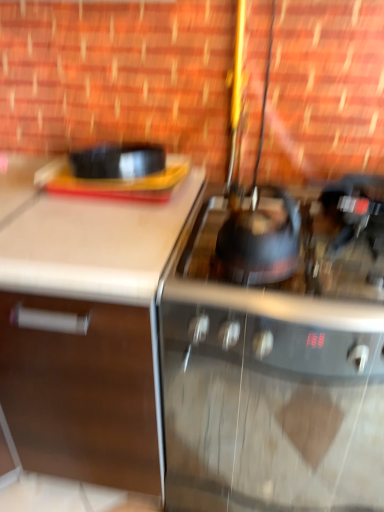
Identify the location of shiny black kettle at center, the second gas stove when ordered from bottom to top. This screenshot has height=512, width=384. (278, 305).

I want to click on stainless steel gas stove at center, the 2th gas stove when ordered from top to bottom, so coord(278,355).

Measure the distance between stainless steel gas stove at center, which ranks as the 1th gas stove in bottom-to-top order, and camera.

stainless steel gas stove at center, which ranks as the 1th gas stove in bottom-to-top order, is 31.04 inches from camera.

What do you see at coordinates (261, 240) in the screenshot?
I see `shiny black kettle at center` at bounding box center [261, 240].

Where is `shiny black kettle at center, the 1th gas stove in the top-to-bottom sequence`? The width and height of the screenshot is (384, 512). shiny black kettle at center, the 1th gas stove in the top-to-bottom sequence is located at coordinates (278, 305).

Between white matte cabinet at left and shiny black kettle at center, which one has less height?

Standing shorter between the two is shiny black kettle at center.

Can you tell me how much white matte cabinet at left and shiny black kettle at center differ in facing direction?

There is a 2.54-degree angle between the facing directions of white matte cabinet at left and shiny black kettle at center.

Relative to shiny black kettle at center, is white matte cabinet at left in front or behind?

Clearly, white matte cabinet at left is in front of shiny black kettle at center.

In the scene shown: From the image's perspective, which object appears higher, shiny black kettle at center or white matte cabinet at left?

shiny black kettle at center, from the image's perspective.

How many degrees apart are the facing directions of shiny black kettle at center and white matte cabinet at left?

There is a 2.54-degree angle between the facing directions of shiny black kettle at center and white matte cabinet at left.

Is white matte cabinet at left surrounded by shiny black kettle at center?

That's incorrect, white matte cabinet at left is not inside shiny black kettle at center.

Can you confirm if shiny black kettle at center is positioned to the left of white matte cabinet at left?

No.

Considering the positions of objects shiny black kettle at center and stainless steel gas stove at center, the 2th gas stove when ordered from top to bottom, in the image provided, who is behind, shiny black kettle at center or stainless steel gas stove at center, the 2th gas stove when ordered from top to bottom,?

stainless steel gas stove at center, the 2th gas stove when ordered from top to bottom.

Would you say shiny black kettle at center is inside or outside stainless steel gas stove at center, which ranks as the 1th gas stove in bottom-to-top order?

shiny black kettle at center is not enclosed by stainless steel gas stove at center, which ranks as the 1th gas stove in bottom-to-top order.

Does shiny black kettle at center touch stainless steel gas stove at center, the 2th gas stove when ordered from top to bottom?

There is a gap between shiny black kettle at center and stainless steel gas stove at center, the 2th gas stove when ordered from top to bottom.

How many degrees apart are the facing directions of white matte cabinet at left and stainless steel gas stove at center, the 2th gas stove when ordered from top to bottom?

There is a 8.17e-05-degree angle between the facing directions of white matte cabinet at left and stainless steel gas stove at center, the 2th gas stove when ordered from top to bottom.

Considering the sizes of white matte cabinet at left and stainless steel gas stove at center, the 2th gas stove when ordered from top to bottom, in the image, is white matte cabinet at left taller or shorter than stainless steel gas stove at center, the 2th gas stove when ordered from top to bottom,?

white matte cabinet at left is taller than stainless steel gas stove at center, the 2th gas stove when ordered from top to bottom.

Considering the relative sizes of white matte cabinet at left and stainless steel gas stove at center, the 2th gas stove when ordered from top to bottom, in the image provided, is white matte cabinet at left wider than stainless steel gas stove at center, the 2th gas stove when ordered from top to bottom,?

Yes.

Does white matte cabinet at left have a larger size compared to stainless steel gas stove at center, the 2th gas stove when ordered from top to bottom?

Yes.

From a real-world perspective, which is physically above, shiny black kettle at center, the 1th gas stove in the top-to-bottom sequence, or shiny black kettle at center?

shiny black kettle at center.

Does shiny black kettle at center, the second gas stove when ordered from bottom to top, have a smaller size compared to shiny black kettle at center?

No, shiny black kettle at center, the second gas stove when ordered from bottom to top, is not smaller than shiny black kettle at center.

From the picture: Is shiny black kettle at center, the 1th gas stove in the top-to-bottom sequence, looking in the opposite direction of shiny black kettle at center?

No, shiny black kettle at center is not at the back of shiny black kettle at center, the 1th gas stove in the top-to-bottom sequence.

Considering the sizes of objects shiny black kettle at center, the second gas stove when ordered from bottom to top, and shiny black kettle at center in the image provided, who is thinner, shiny black kettle at center, the second gas stove when ordered from bottom to top, or shiny black kettle at center?

Thinner between the two is shiny black kettle at center.

Is stainless steel gas stove at center, which ranks as the 1th gas stove in bottom-to-top order, aimed at shiny black kettle at center, the second gas stove when ordered from bottom to top?

Answer: No, stainless steel gas stove at center, which ranks as the 1th gas stove in bottom-to-top order, is not aimed at shiny black kettle at center, the second gas stove when ordered from bottom to top.

Between stainless steel gas stove at center, which ranks as the 1th gas stove in bottom-to-top order, and shiny black kettle at center, the 1th gas stove in the top-to-bottom sequence, which one appears on the left side from the viewer's perspective?

From the viewer's perspective, shiny black kettle at center, the 1th gas stove in the top-to-bottom sequence, appears more on the left side.

Between point (355, 195) and point (287, 301), which one is positioned in front?

The point (287, 301) is closer.

Would you consider stainless steel gas stove at center, which ranks as the 1th gas stove in bottom-to-top order, to be distant from shiny black kettle at center, the second gas stove when ordered from bottom to top?

Actually, stainless steel gas stove at center, which ranks as the 1th gas stove in bottom-to-top order, and shiny black kettle at center, the second gas stove when ordered from bottom to top, are a little close together.

Consider the image. Between shiny black kettle at center and shiny black kettle at center, the second gas stove when ordered from bottom to top, which one has smaller width?

shiny black kettle at center.

What's the angular difference between shiny black kettle at center and shiny black kettle at center, the second gas stove when ordered from bottom to top,'s facing directions?

There is a 2.54-degree angle between the facing directions of shiny black kettle at center and shiny black kettle at center, the second gas stove when ordered from bottom to top.

From a real-world perspective, is shiny black kettle at center positioned over shiny black kettle at center, the second gas stove when ordered from bottom to top, based on gravity?

Yes, from a real-world perspective, shiny black kettle at center is on top of shiny black kettle at center, the second gas stove when ordered from bottom to top.

Which object is closer to the camera taking this photo, shiny black kettle at center or shiny black kettle at center, the second gas stove when ordered from bottom to top?

shiny black kettle at center, the second gas stove when ordered from bottom to top, is more forward.

Locate an element on the screen. The width and height of the screenshot is (384, 512). kitchen appliance that is above the white matte cabinet at left (from a real-world perspective) is located at coordinates (261, 240).

The image size is (384, 512). What are the coordinates of `kitchen appliance behind the white matte cabinet at left` in the screenshot? It's located at pos(261,240).

Considering their positions, is white matte cabinet at left positioned further to stainless steel gas stove at center, the 2th gas stove when ordered from top to bottom, than shiny black kettle at center, the second gas stove when ordered from bottom to top?

white matte cabinet at left lies further to stainless steel gas stove at center, the 2th gas stove when ordered from top to bottom, than the other object.

When comparing their distances from stainless steel gas stove at center, which ranks as the 1th gas stove in bottom-to-top order, does shiny black kettle at center, the second gas stove when ordered from bottom to top, or white matte cabinet at left seem further?

white matte cabinet at left is positioned further to the anchor stainless steel gas stove at center, which ranks as the 1th gas stove in bottom-to-top order.

When comparing their distances from shiny black kettle at center, the second gas stove when ordered from bottom to top, does shiny black kettle at center or stainless steel gas stove at center, the 2th gas stove when ordered from top to bottom, seem further?

The object further to shiny black kettle at center, the second gas stove when ordered from bottom to top, is stainless steel gas stove at center, the 2th gas stove when ordered from top to bottom.

Based on their spatial positions, is shiny black kettle at center, the second gas stove when ordered from bottom to top, or shiny black kettle at center further from white matte cabinet at left?

Based on the image, shiny black kettle at center appears to be further to white matte cabinet at left.

Considering their positions, is stainless steel gas stove at center, which ranks as the 1th gas stove in bottom-to-top order, positioned further to shiny black kettle at center than shiny black kettle at center, the 1th gas stove in the top-to-bottom sequence?

stainless steel gas stove at center, which ranks as the 1th gas stove in bottom-to-top order, is further to shiny black kettle at center.

Estimate the real-world distances between objects in this image. Which object is further from shiny black kettle at center, the second gas stove when ordered from bottom to top, stainless steel gas stove at center, which ranks as the 1th gas stove in bottom-to-top order, or white matte cabinet at left?

white matte cabinet at left is positioned further to the anchor shiny black kettle at center, the second gas stove when ordered from bottom to top.

Looking at the image, which one is located further to white matte cabinet at left, shiny black kettle at center, the second gas stove when ordered from bottom to top, or stainless steel gas stove at center, the 2th gas stove when ordered from top to bottom?

shiny black kettle at center, the second gas stove when ordered from bottom to top, is further to white matte cabinet at left.

When comparing their distances from shiny black kettle at center, does stainless steel gas stove at center, which ranks as the 1th gas stove in bottom-to-top order, or white matte cabinet at left seem closer?

stainless steel gas stove at center, which ranks as the 1th gas stove in bottom-to-top order.

Locate an element on the screen. The height and width of the screenshot is (512, 384). kitchen appliance between white matte cabinet at left and shiny black kettle at center, the second gas stove when ordered from bottom to top is located at coordinates (261, 240).

I want to click on kitchen appliance located between white matte cabinet at left and stainless steel gas stove at center, the 2th gas stove when ordered from top to bottom, in the left-right direction, so click(x=261, y=240).

Where is `gas stove between shiny black kettle at center and stainless steel gas stove at center, which ranks as the 1th gas stove in bottom-to-top order, from top to bottom`? This screenshot has width=384, height=512. gas stove between shiny black kettle at center and stainless steel gas stove at center, which ranks as the 1th gas stove in bottom-to-top order, from top to bottom is located at coordinates (278, 305).

This screenshot has width=384, height=512. I want to click on gas stove located between white matte cabinet at left and stainless steel gas stove at center, which ranks as the 1th gas stove in bottom-to-top order, in the left-right direction, so click(278, 305).